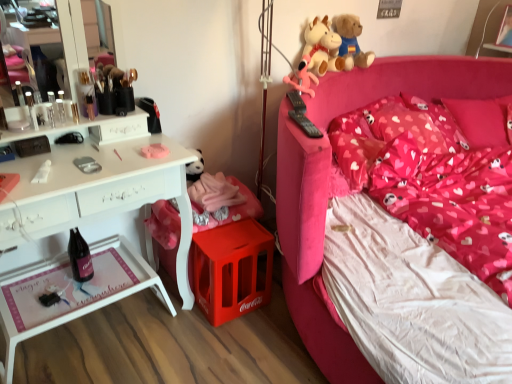
Where is `free spot to the right of black glass bottle at lower left`? free spot to the right of black glass bottle at lower left is located at coordinates (117, 284).